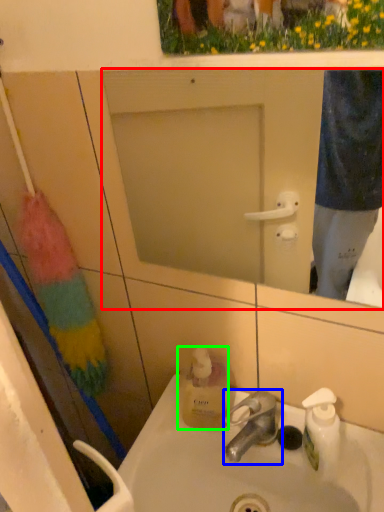
Question: Based on their relative distances, which object is farther from mirror (highlighted by a red box)? Choose from tap (highlighted by a blue box) and bottle (highlighted by a green box).

Choices:
 (A) tap
 (B) bottle

Answer: (A)